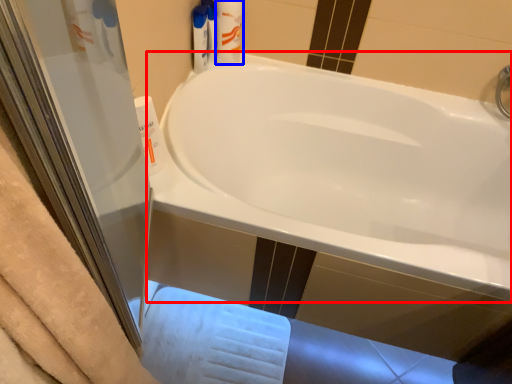
Question: Which point is further to the camera, bathtub (highlighted by a red box) or toiletry (highlighted by a blue box)?

Choices:
 (A) bathtub
 (B) toiletry

Answer: (B)